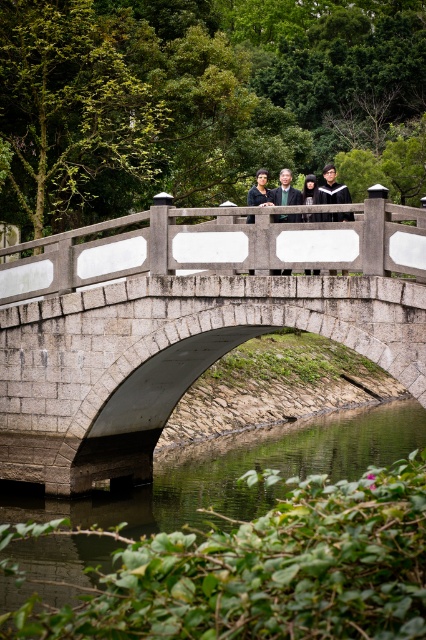
You are standing on the stone bridge and want to take a photo of the smooth concrete water at center. Where exactly should you aim your camera to capture it?

You should aim your camera at point coordinates of [249,544] to capture the smooth concrete water at center.